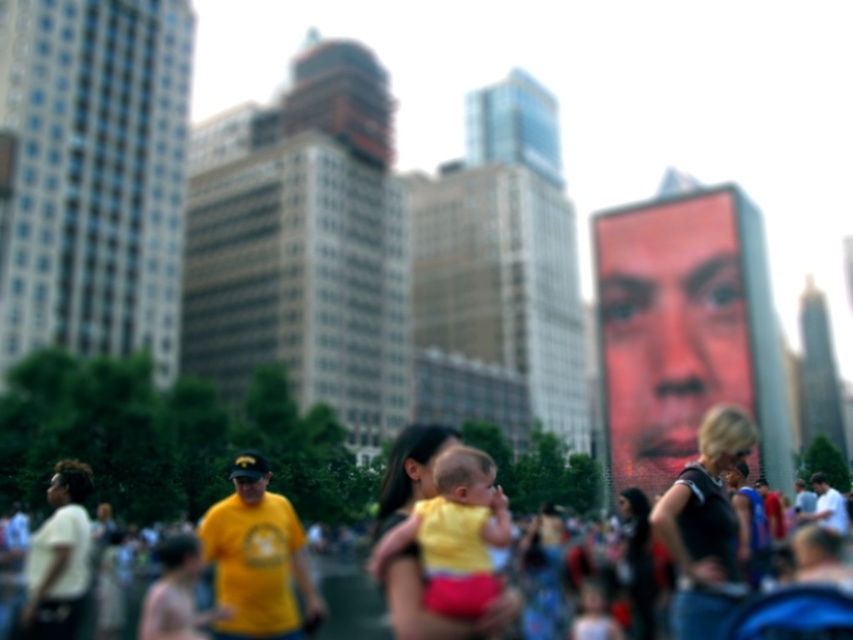
You are a photographer trying to capture a closeup of the black matte dress at center and the yellow fabric baby at center. Since the camera can only focus on one subject at a time, which one should you choose to ensure it appears sharp and in focus?

The black matte dress at center is bigger than the yellow fabric baby at center, so you should focus on the black matte dress at center to ensure it appears sharp and in focus.

You are a photographer who wants to focus on the black matte dress at center in your photo. What are the coordinates of the dress in the image?

The coordinates of the black matte dress at center are at point (705, 525).

You are standing at the camera position and want to know how far the point at coordinates (x=701, y=582) is from you. Can you determine the distance?

The point at coordinates (x=701, y=582) is 42.99 meters away from the camera position.